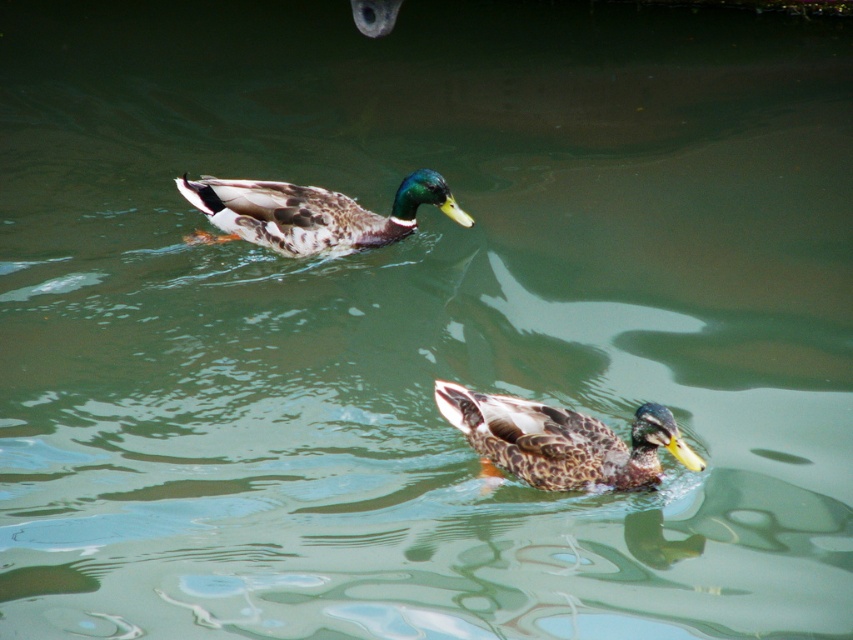
Question: Is speckled brown duck at center to the right of speckled feathered duck at upper center from the viewer's perspective?

Choices:
 (A) yes
 (B) no

Answer: (A)

Question: Does speckled brown duck at center have a lesser width compared to speckled feathered duck at upper center?

Choices:
 (A) no
 (B) yes

Answer: (B)

Question: Which object is farther from the camera taking this photo?

Choices:
 (A) speckled brown duck at center
 (B) speckled feathered duck at upper center

Answer: (B)

Question: From the image, what is the correct spatial relationship of speckled brown duck at center in relation to speckled feathered duck at upper center?

Choices:
 (A) above
 (B) below

Answer: (B)